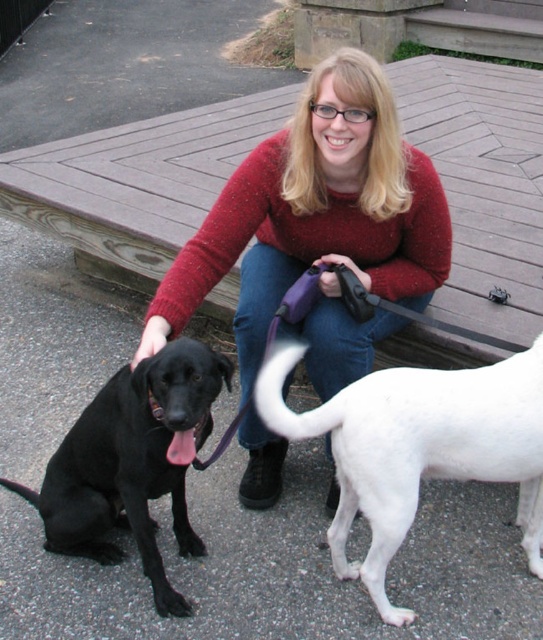
Where is the red sweater at center located in the image?

The red sweater at center is located at point (315, 212) in the image.

You are a photographer trying to capture the scene where the woman in the red sweater at center is holding the black smooth fur dog at left. From the perspective of the photographer standing behind the woman, which side should you position yourself to ensure both the woman and the dog are fully visible in the frame?

The red sweater at center is to the right of the black smooth fur dog at left, so the photographer should position themselves to the left side of the woman to ensure both the woman and the dog are fully visible in the frame.